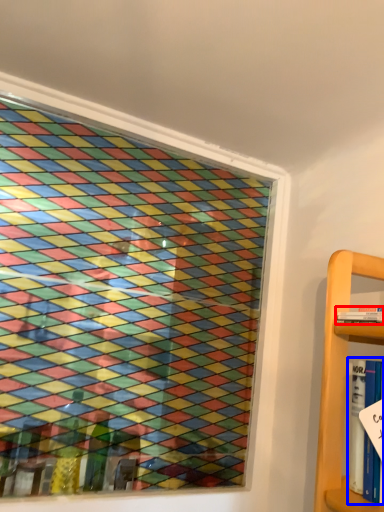
Question: Among these objects, which one is farthest to the camera, book (highlighted by a red box) or book (highlighted by a blue box)?

Choices:
 (A) book
 (B) book

Answer: (A)